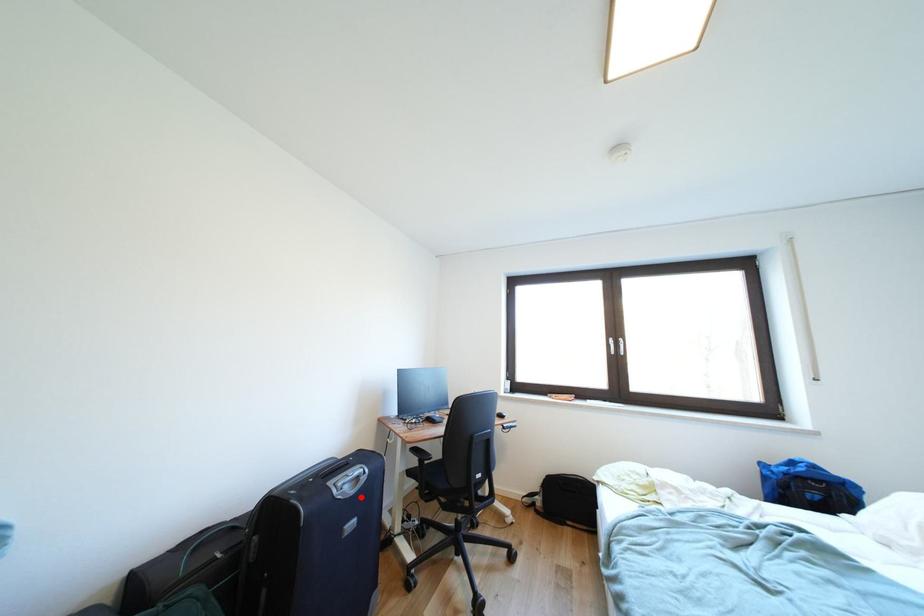
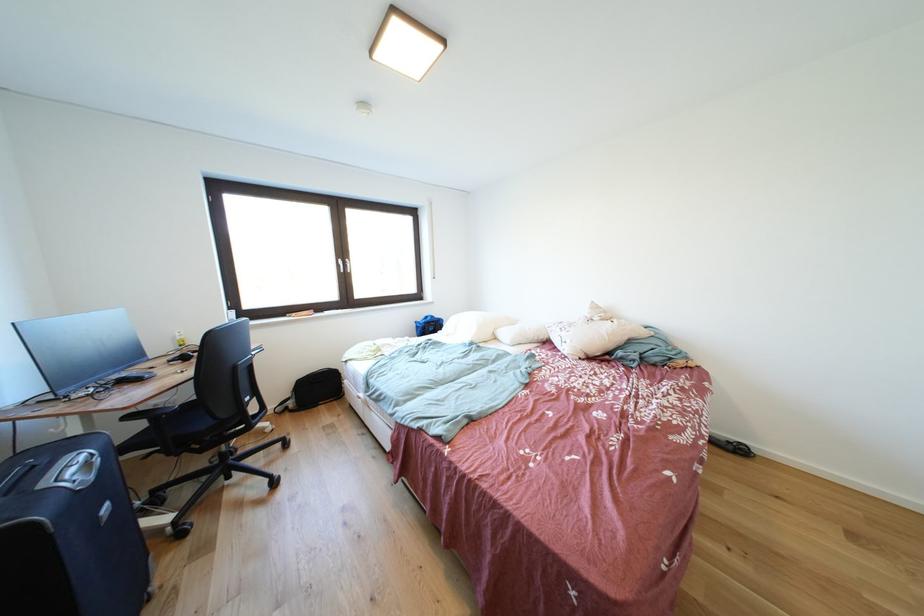
Locate, in the second image, the point that corresponds to the highlighted location in the first image.

(101, 483)